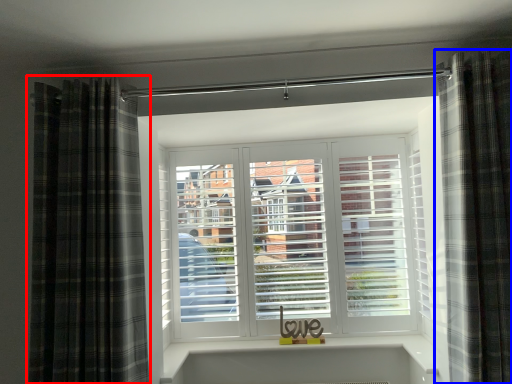
Question: Among these objects, which one is nearest to the camera, curtain (highlighted by a red box) or curtain (highlighted by a blue box)?

Choices:
 (A) curtain
 (B) curtain

Answer: (B)